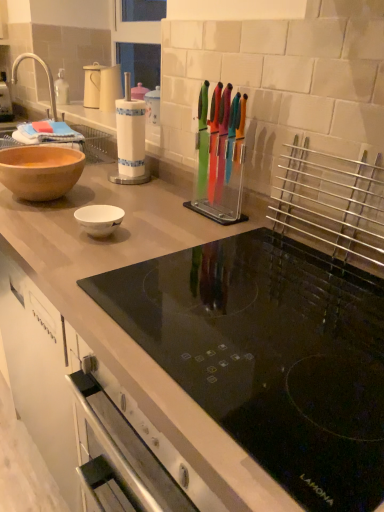
Question: Could matte white container at upper left be considered to be inside transparent plastic knife block at center, marked as the 2th appliance in a left-to-right arrangement?

Choices:
 (A) yes
 (B) no

Answer: (B)

Question: Does transparent plastic knife block at center, which ranks as the 1th appliance in front-to-back order, have a greater width compared to matte white container at upper left?

Choices:
 (A) no
 (B) yes

Answer: (A)

Question: Does transparent plastic knife block at center, arranged as the 2th appliance when viewed from the back, have a lesser width compared to matte white container at upper left?

Choices:
 (A) yes
 (B) no

Answer: (A)

Question: Considering the relative positions of transparent plastic knife block at center, placed as the 1th appliance when sorted from right to left, and matte white container at upper left in the image provided, is transparent plastic knife block at center, placed as the 1th appliance when sorted from right to left, in front of matte white container at upper left?

Choices:
 (A) no
 (B) yes

Answer: (B)

Question: Is transparent plastic knife block at center, marked as the 2th appliance in a left-to-right arrangement, looking in the opposite direction of matte white container at upper left?

Choices:
 (A) yes
 (B) no

Answer: (B)

Question: From the image's perspective, relative to matte white container at upper left, is matte brown bowl at left above or below?

Choices:
 (A) below
 (B) above

Answer: (A)

Question: In terms of size, does matte brown bowl at left appear bigger or smaller than matte white container at upper left?

Choices:
 (A) small
 (B) big

Answer: (B)

Question: Would you say matte brown bowl at left is to the left or to the right of matte white container at upper left in the picture?

Choices:
 (A) right
 (B) left

Answer: (A)

Question: Considering the positions of point (61, 164) and point (97, 75), is point (61, 164) closer or farther from the camera than point (97, 75)?

Choices:
 (A) closer
 (B) farther

Answer: (A)

Question: In terms of size, does transparent plastic knife block at center, placed as the 1th appliance when sorted from right to left, appear bigger or smaller than matte brown bowl at left?

Choices:
 (A) small
 (B) big

Answer: (A)

Question: From the image's perspective, relative to matte brown bowl at left, is transparent plastic knife block at center, placed as the 1th appliance when sorted from right to left, above or below?

Choices:
 (A) below
 (B) above

Answer: (B)

Question: Would you say transparent plastic knife block at center, marked as the 2th appliance in a left-to-right arrangement, is inside or outside matte brown bowl at left?

Choices:
 (A) outside
 (B) inside

Answer: (A)

Question: Looking at their shapes, would you say transparent plastic knife block at center, arranged as the 2th appliance when viewed from the back, is wider or thinner than matte brown bowl at left?

Choices:
 (A) thin
 (B) wide

Answer: (A)

Question: Is white paper towel holder at center, the 1th appliance in the back-to-front sequence, to the left or to the right of matte brown bowl at left in the image?

Choices:
 (A) right
 (B) left

Answer: (A)

Question: In the image, is white paper towel holder at center, the first appliance positioned from the left, positioned in front of or behind matte brown bowl at left?

Choices:
 (A) behind
 (B) front

Answer: (A)